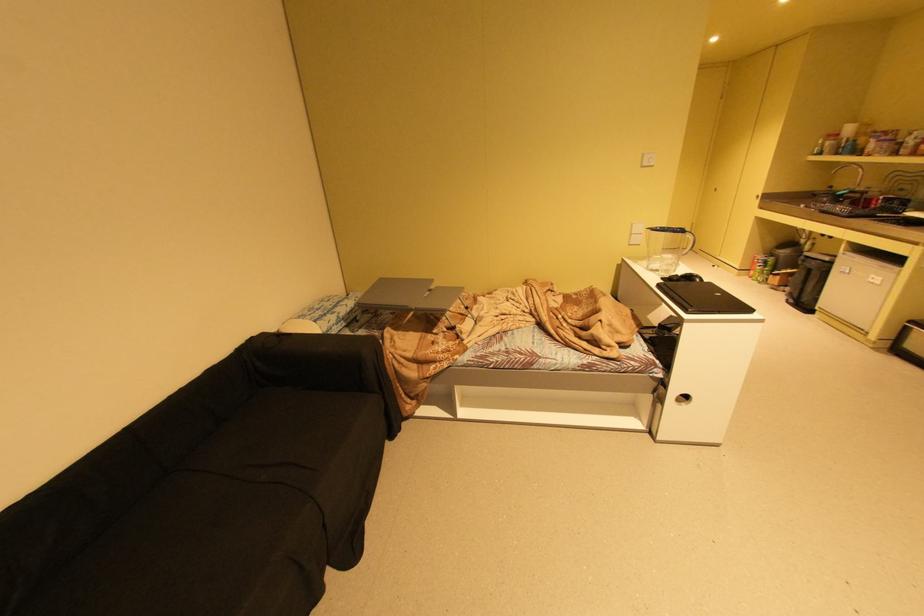
What do you see at coordinates (694, 243) in the screenshot?
I see `the clear pitcher handle` at bounding box center [694, 243].